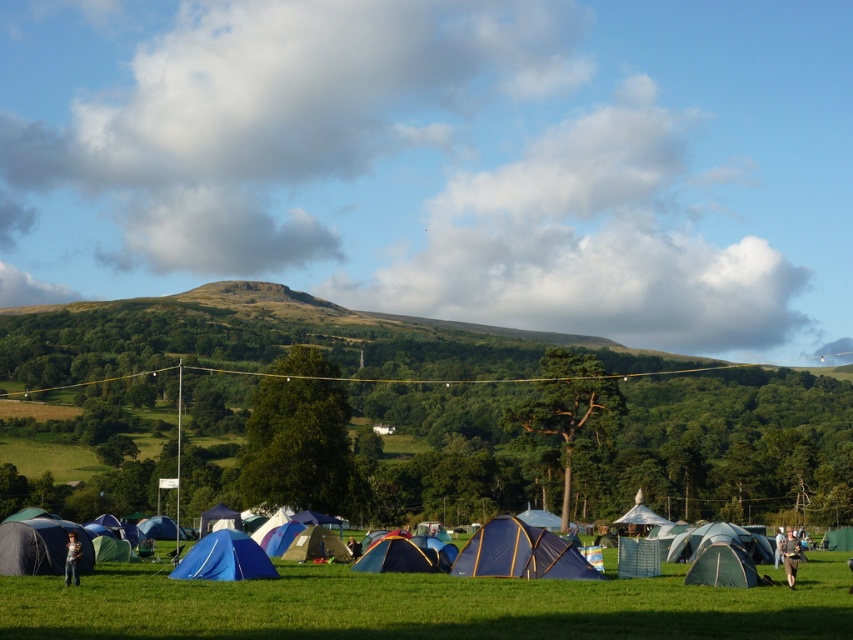
Question: Is blue fabric tent at center closer to the viewer compared to light brown fabric jacket at lower right?

Choices:
 (A) yes
 (B) no

Answer: (B)

Question: Estimate the real-world distances between objects in this image. Which object is closer to the blue tarpaulin tent at center?

Choices:
 (A) blue fabric tent at lower left
 (B) green fabric tent at center
 (C) blue fabric tent at center

Answer: (C)

Question: Is blue fabric tents at lower center above green fabric tent at center?

Choices:
 (A) yes
 (B) no

Answer: (B)

Question: In this image, where is blue fabric tent at center located relative to blue fabric tent at lower center?

Choices:
 (A) left
 (B) right

Answer: (B)

Question: Which of the following is the closest to the observer?

Choices:
 (A) (784, 566)
 (B) (738, 547)
 (C) (247, 563)

Answer: (C)

Question: Which point is closer to the camera?

Choices:
 (A) blue fabric tent at lower left
 (B) light brown fabric jacket at lower right

Answer: (A)